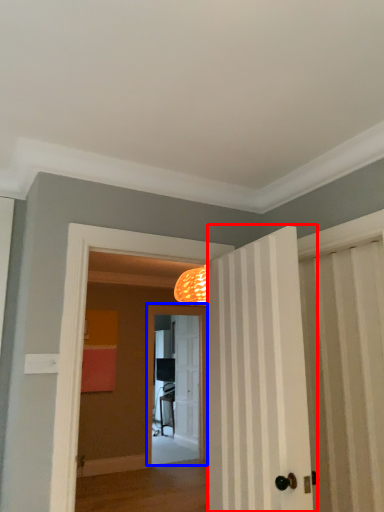
Question: Which object appears farthest to the camera in this image, door (highlighted by a red box) or screen door (highlighted by a blue box)?

Choices:
 (A) door
 (B) screen door

Answer: (B)